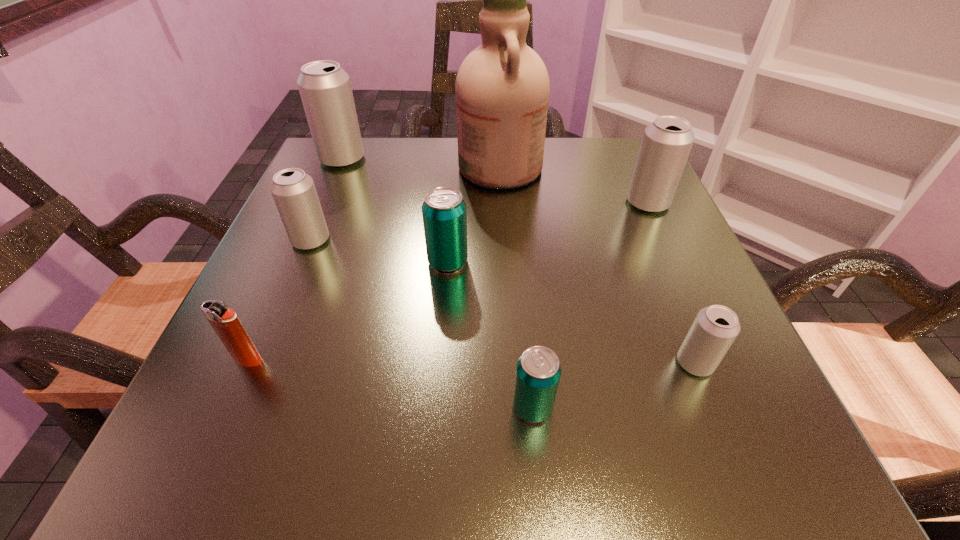
Identify the location of the tallest object. (502, 87).

Image resolution: width=960 pixels, height=540 pixels. I want to click on the farthest white beer can, so click(325, 89).

I want to click on the second tallest object, so click(325, 89).

Where is `the second biggest white beer can`? the second biggest white beer can is located at coordinates (666, 143).

I want to click on the third nearest white beer can, so click(x=666, y=143).

Find the location of a particular element. The image size is (960, 540). the second nearest white beer can is located at coordinates (294, 192).

You are a GUI agent. You are given a task and a screenshot of the screen. Output one action in this format:
    pyautogui.click(x=<x>, y=<y>)
    Task: Click on the farther teal beer can
    This screenshot has height=540, width=960.
    Given the screenshot: What is the action you would take?
    pyautogui.click(x=444, y=214)

You are a GUI agent. You are given a task and a screenshot of the screen. Output one action in this format:
    pyautogui.click(x=<x>, y=<y>)
    Task: Click on the bigger teal beer can
    The width and height of the screenshot is (960, 540).
    Given the screenshot: What is the action you would take?
    tap(444, 214)

Locate an element on the screen. The height and width of the screenshot is (540, 960). igniter is located at coordinates (225, 322).

At what (x,y) coordinates should I click in order to perform the action: click on the nearest white beer can. Please return your answer as a coordinate pair (x, y). The image size is (960, 540). Looking at the image, I should click on (715, 328).